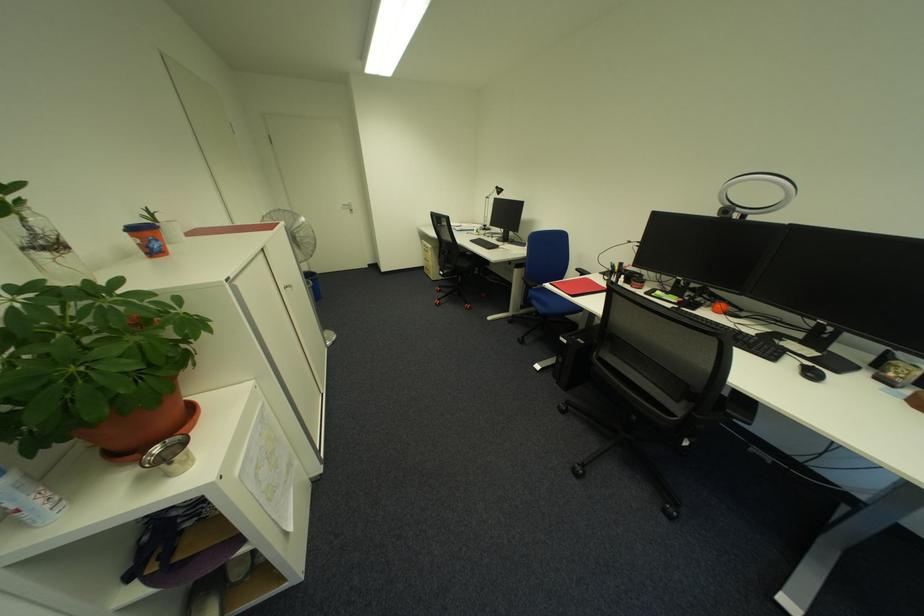
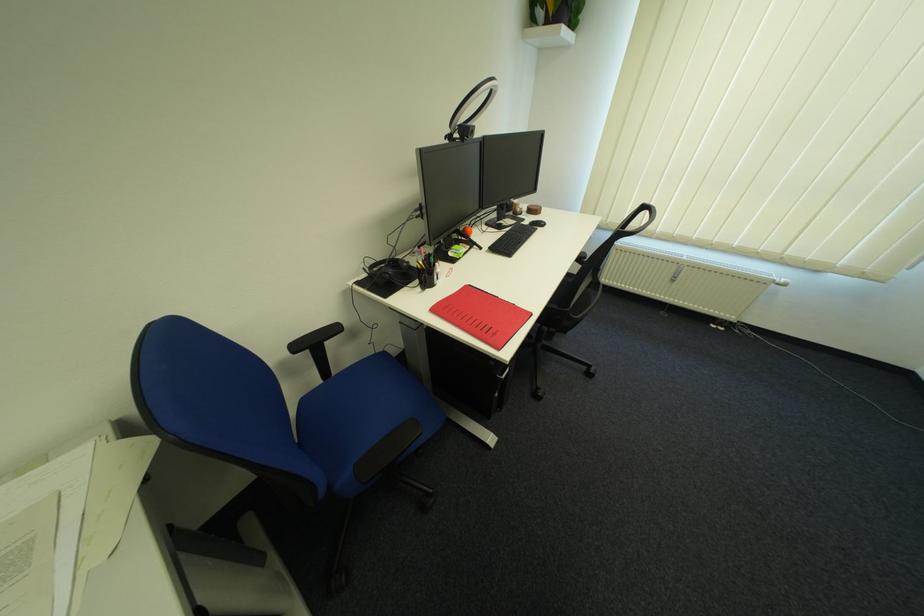
The point at (588, 270) is marked in the first image. Where is the corresponding point in the second image?

(306, 349)